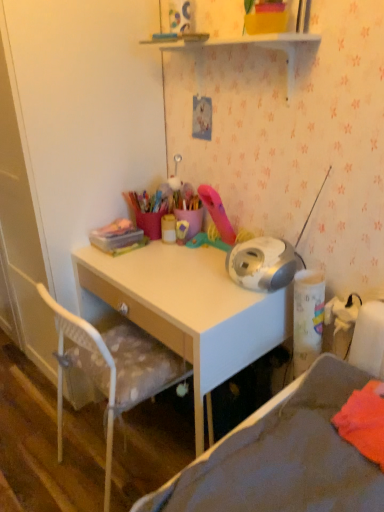
The height and width of the screenshot is (512, 384). In order to click on empty space that is ontop of white mesh chair at lower left (from a real-world perspective) in this screenshot , I will do `click(62, 422)`.